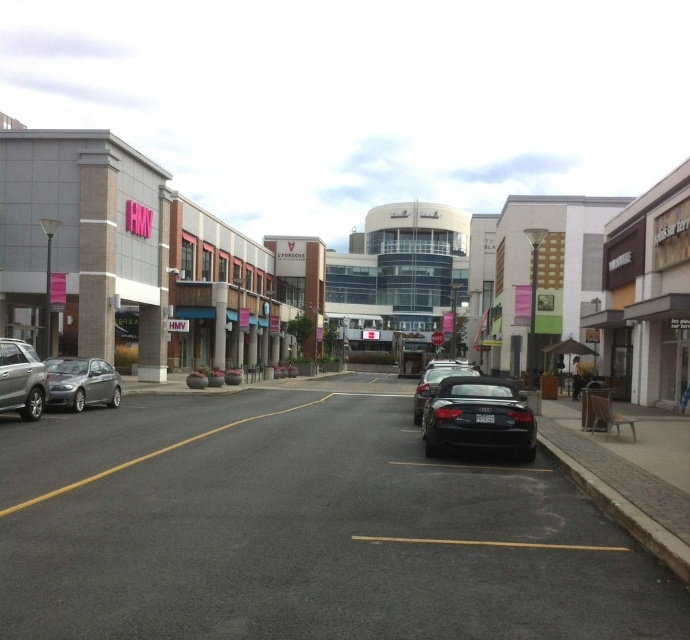
Who is positioned more to the right, black matte convertible at center or silver metallic sedan at left?

black matte convertible at center is more to the right.

Can you confirm if black matte convertible at center is taller than silver metallic sedan at left?

No.

You are a GUI agent. You are given a task and a screenshot of the screen. Output one action in this format:
    pyautogui.click(x=<x>, y=<y>)
    Task: Click on the black matte convertible at center
    The image size is (690, 640).
    Given the screenshot: What is the action you would take?
    tap(477, 417)

Is black matte convertible at center further to camera compared to satin silver sedan at left?

→ No, black matte convertible at center is in front of satin silver sedan at left.

Looking at this image, does black matte convertible at center have a greater height compared to satin silver sedan at left?

No, black matte convertible at center is not taller than satin silver sedan at left.

Is point (500, 433) closer to camera compared to point (118, 392)?

Yes, point (500, 433) is in front of point (118, 392).

Where is `black matte convertible at center`? black matte convertible at center is located at coordinates (477, 417).

Which is more to the left, black matte convertible at center or black matte car at center?

Positioned to the left is black matte convertible at center.

Can you confirm if black matte convertible at center is thinner than black matte car at center?

Yes.

Measure the distance between black matte convertible at center and camera.

black matte convertible at center and camera are 11.60 meters apart from each other.

This screenshot has height=640, width=690. Find the location of `black matte convertible at center`. black matte convertible at center is located at coordinates (477, 417).